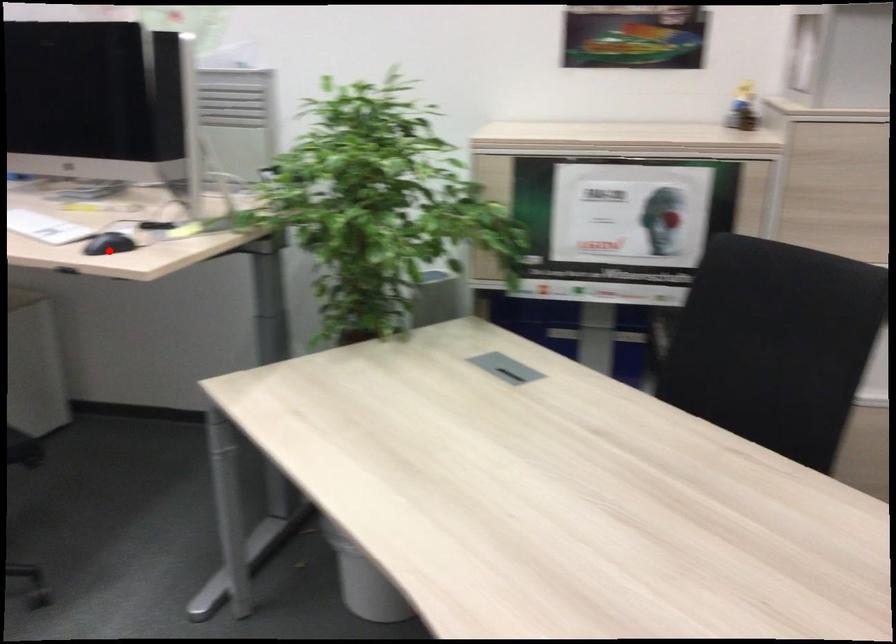
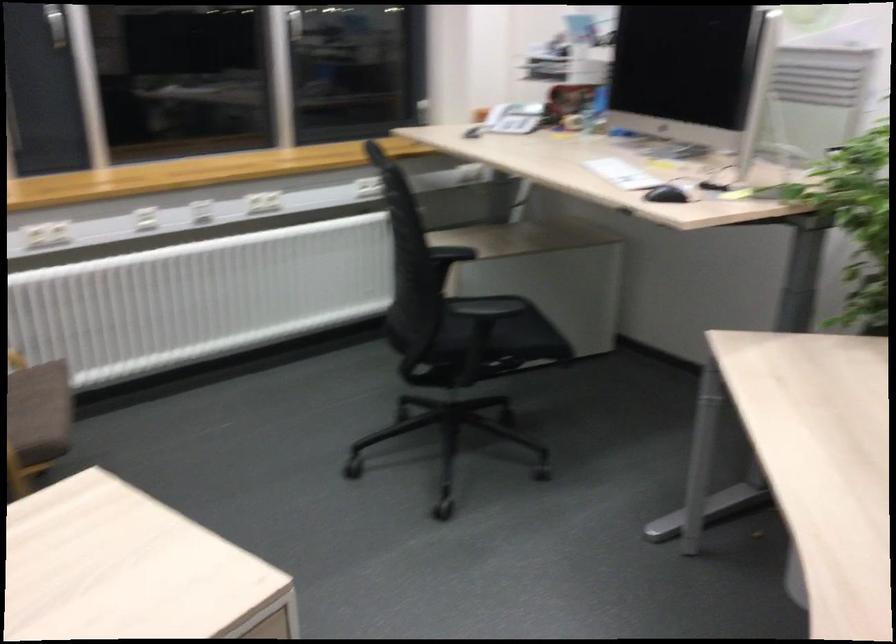
Question: I am providing you with two images of the same scene from different viewpoints. Given a red point in image1, look at the same physical point in image2. Is it:

Choices:
 (A) Closer to the viewpoint
 (B) Farther from the viewpoint

Answer: (B)